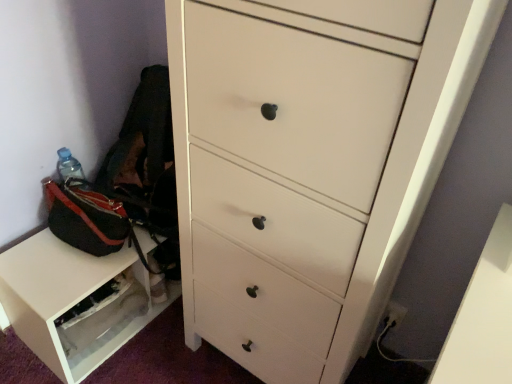
Identify the location of free spot to the right of transparent plastic drawer at lower left. The height and width of the screenshot is (384, 512). (162, 349).